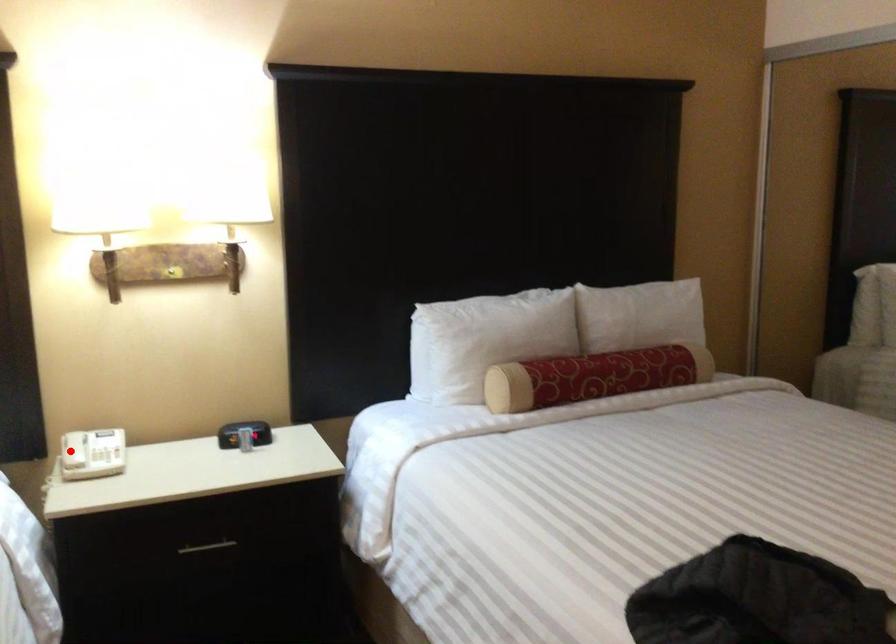
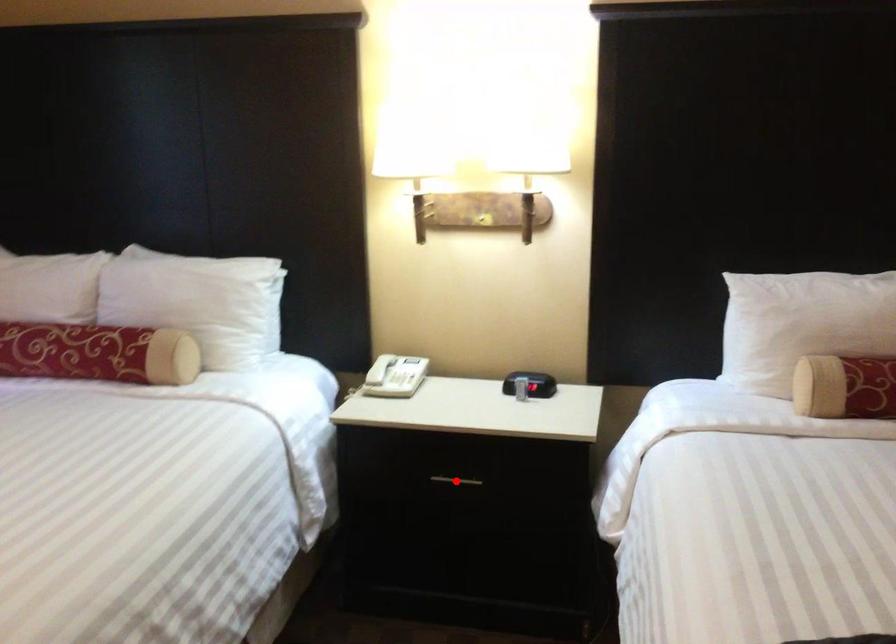
I am providing you with two images of the same scene from different viewpoints. A red point is marked on the first image and another point is marked on the second image. Are the points marked in image1 and image2 representing the same 3D position?

No